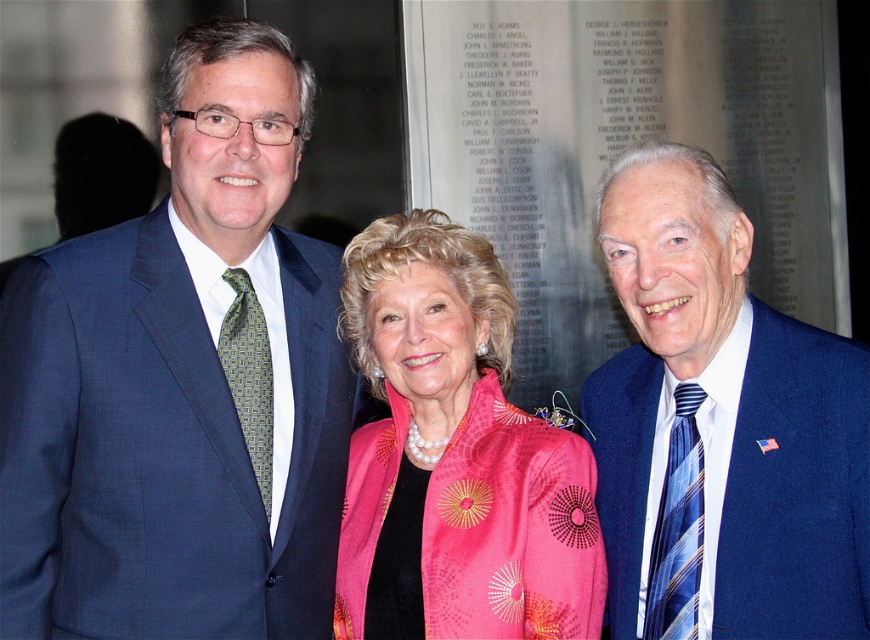
Does blue textured suit at right appear under pink brocade scarf at center?

No.

Can you confirm if blue textured suit at right is smaller than pink brocade scarf at center?

Indeed, blue textured suit at right has a smaller size compared to pink brocade scarf at center.

Does point (678, 196) come closer to viewer compared to point (435, 604)?

Yes, it is.

The height and width of the screenshot is (640, 870). In order to click on blue textured suit at right in this screenshot , I will do `click(720, 426)`.

In the scene shown: Does blue striped tie at right appear under greengeometric patterned fabrictie at left?

Indeed, blue striped tie at right is positioned under greengeometric patterned fabrictie at left.

Can you confirm if blue striped tie at right is positioned to the left of greengeometric patterned fabrictie at left?

In fact, blue striped tie at right is to the right of greengeometric patterned fabrictie at left.

The width and height of the screenshot is (870, 640). What do you see at coordinates (678, 528) in the screenshot?
I see `blue striped tie at right` at bounding box center [678, 528].

The height and width of the screenshot is (640, 870). What are the coordinates of `blue striped tie at right` in the screenshot? It's located at (678, 528).

Consider the image. Is pink brocade scarf at center wider than blue striped tie at right?

Correct, the width of pink brocade scarf at center exceeds that of blue striped tie at right.

Between pink brocade scarf at center and blue striped tie at right, which one appears on the right side from the viewer's perspective?

blue striped tie at right is more to the right.

Who is more distant from viewer, (x=357, y=627) or (x=666, y=538)?

The point (x=357, y=627) is more distant.

The width and height of the screenshot is (870, 640). I want to click on pink brocade scarf at center, so point(454,456).